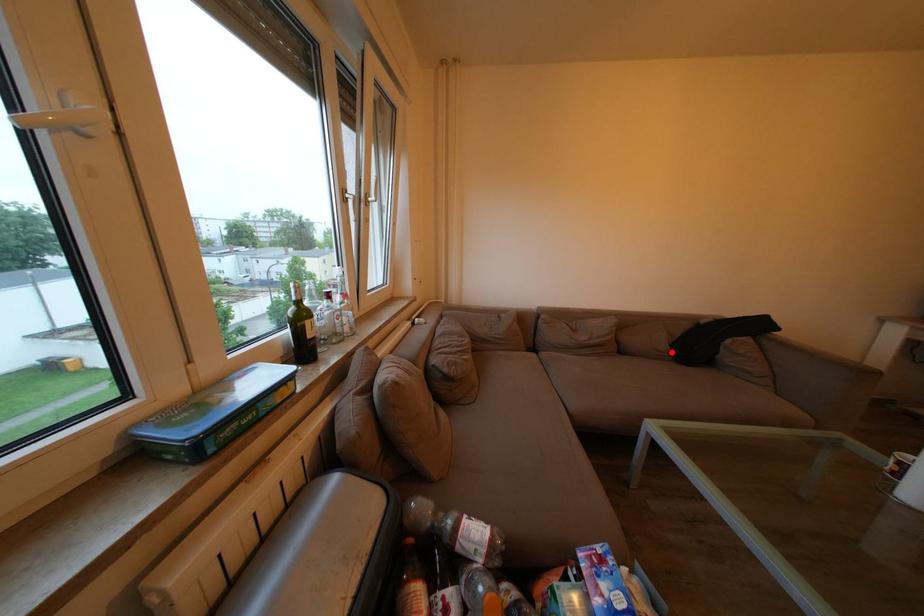
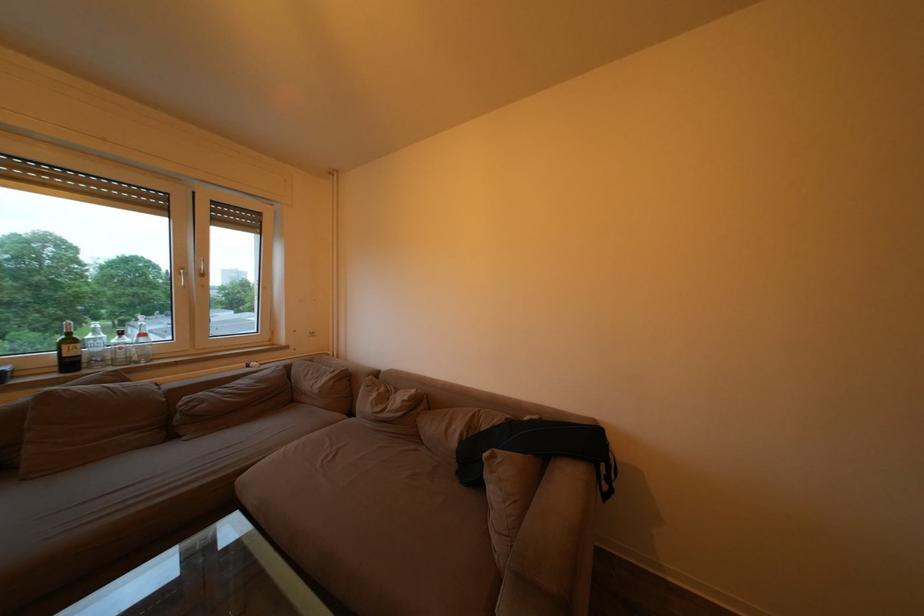
Question: A red point is marked in image1. In image2, is the corresponding 3D point closer to the camera or farther? Reply with the corresponding letter.

Choices:
 (A) The corresponding 3D point is closer.
 (B) The corresponding 3D point is farther.

Answer: (B)